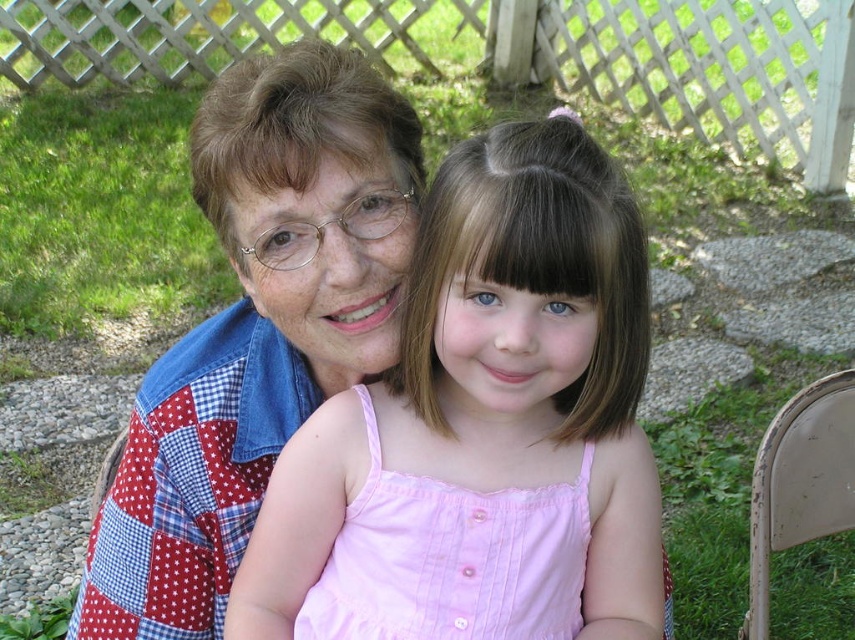
You are standing in the backyard and want to place a small potted plant between the two points marked as point (378,369) and point (411,576). Which point should you position the plant closer to so that it appears closer to the viewer?

You should position the potted plant closer to point (378,369) because it is closer to the viewer compared to point (411,576).

You are a photographer setting up for a family portrait. You notice the pink cotton dress at center and the beige plastic chair at lower right. Which object is shorter in height?

The pink cotton dress at center is not as tall as the beige plastic chair at lower right, so the pink cotton dress at center is shorter.